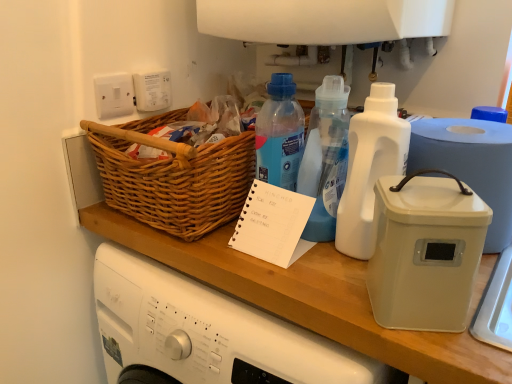
Question: From the image's perspective, is white plastic container at right on white plastic bottle at center, the second bottle viewed from the right?

Choices:
 (A) no
 (B) yes

Answer: (A)

Question: Does white plastic container at right have a lesser height compared to white plastic bottle at center, the 1th bottle when ordered from left to right?

Choices:
 (A) no
 (B) yes

Answer: (B)

Question: Does white plastic container at right appear on the right side of white plastic bottle at center, the second bottle viewed from the right?

Choices:
 (A) no
 (B) yes

Answer: (B)

Question: Is white plastic container at right facing towards white plastic bottle at center, the second bottle viewed from the right?

Choices:
 (A) no
 (B) yes

Answer: (A)

Question: From a real-world perspective, does white plastic container at right stand above white plastic bottle at center, the second bottle viewed from the right?

Choices:
 (A) yes
 (B) no

Answer: (B)

Question: Looking at their shapes, would you say white plastic container at right is wider or thinner than woven wood basket at upper left?

Choices:
 (A) wide
 (B) thin

Answer: (B)

Question: In terms of height, does white plastic container at right look taller or shorter compared to woven wood basket at upper left?

Choices:
 (A) short
 (B) tall

Answer: (B)

Question: Considering their positions, is white plastic container at right located in front of or behind woven wood basket at upper left?

Choices:
 (A) behind
 (B) front

Answer: (B)

Question: Is white plastic container at right spatially inside woven wood basket at upper left, or outside of it?

Choices:
 (A) outside
 (B) inside

Answer: (A)

Question: From the image's perspective, relative to white plastic container at right, is white paper notepad at center above or below?

Choices:
 (A) below
 (B) above

Answer: (A)

Question: Based on their positions, is white paper notepad at center located to the left or right of white plastic container at right?

Choices:
 (A) right
 (B) left

Answer: (B)

Question: From a real-world perspective, is white paper notepad at center above or below white plastic container at right?

Choices:
 (A) below
 (B) above

Answer: (A)

Question: Is white paper notepad at center spatially inside white plastic container at right, or outside of it?

Choices:
 (A) outside
 (B) inside

Answer: (A)

Question: From a real-world perspective, is white plastic container at right positioned above or below white paper notepad at center?

Choices:
 (A) below
 (B) above

Answer: (B)

Question: Is white plastic container at right spatially inside white paper notepad at center, or outside of it?

Choices:
 (A) outside
 (B) inside

Answer: (A)